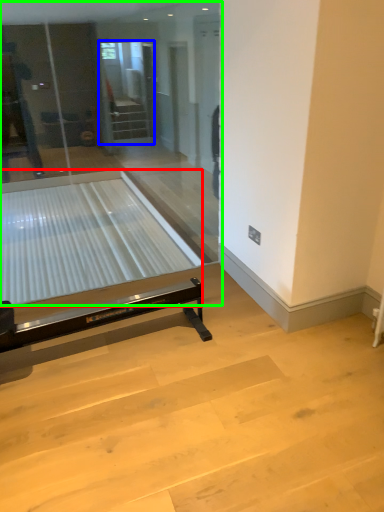
Question: Which is nearer to the glass table (highlighted by a red box)? screen door (highlighted by a blue box) or glass door (highlighted by a green box).

Choices:
 (A) screen door
 (B) glass door

Answer: (B)